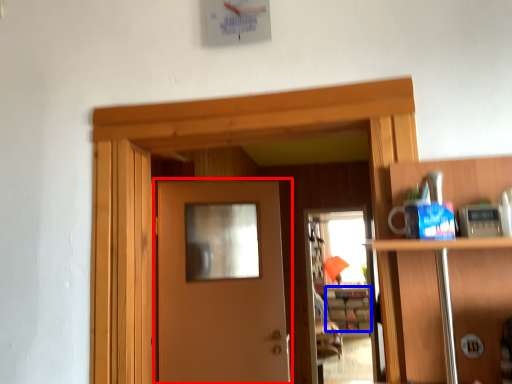
Question: Which object is closer to the camera taking this photo, door (highlighted by a red box) or cabinetry (highlighted by a blue box)?

Choices:
 (A) door
 (B) cabinetry

Answer: (A)